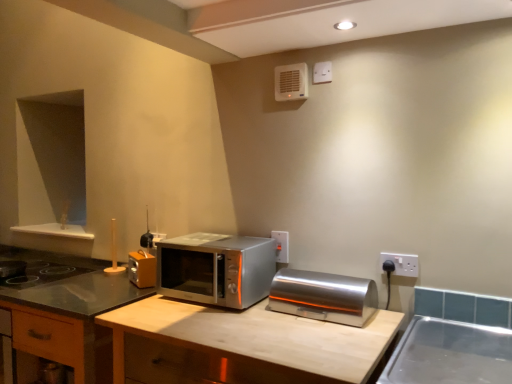
I want to click on free space on the front side of satin silver toaster at center, so click(332, 329).